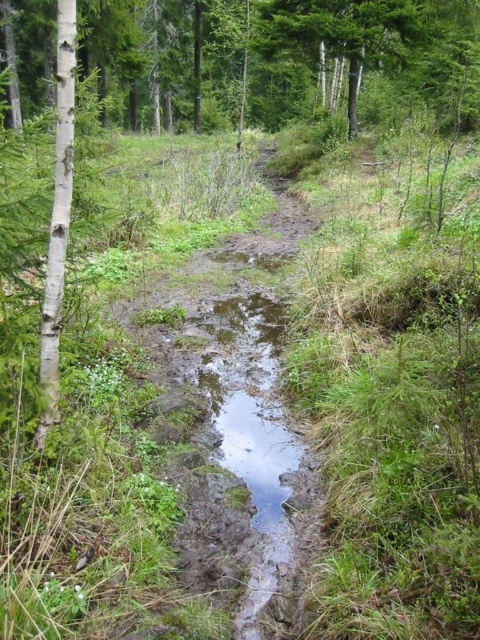
You are a hiker navigating a narrow, muddy path through a forest. You notice two points marked on your map corresponding to coordinates in the scene. The first point is at location point (x=447, y=65) and the second is at point (x=62, y=196). Which point is closer to you as you stand on the path?

Point (x=62, y=196) is closer to you because the description states that point (x=447, y=65) is further to the viewer than point (x=62, y=196).

You are a hiker trying to navigate the narrow, muddy path through the forest. You notice the green matte tree at upper center and the white smooth tree at left. Which tree would you need to look up higher to see the top of?

The green matte tree at upper center has a greater height compared to the white smooth tree at left, so you would need to look up higher to see the top of the green matte tree at upper center.

You are a hiker trying to navigate a narrow muddy path in a forest. You see a point marked at coordinates (266, 52). Which object is this point located on?

The point at (266, 52) is located on the green matte tree at upper center.